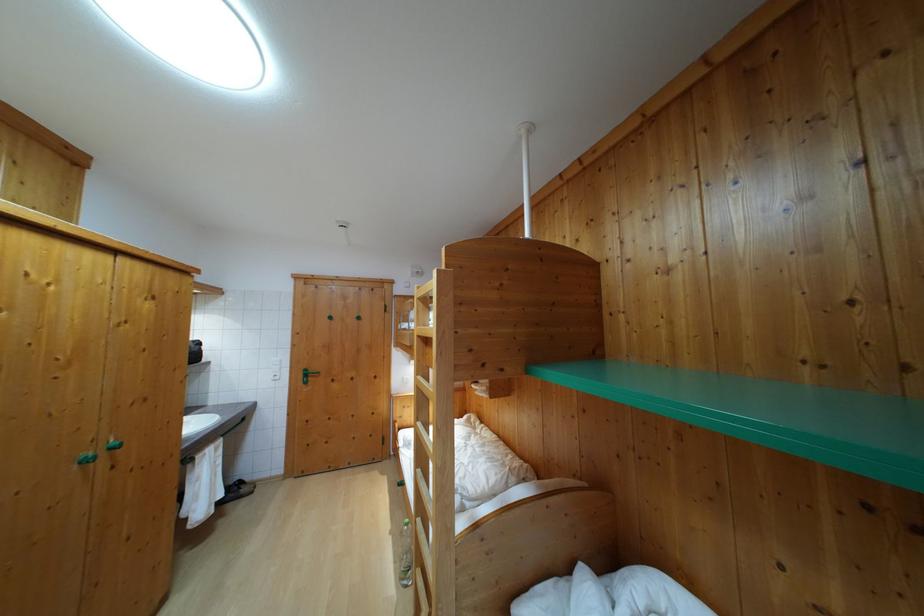
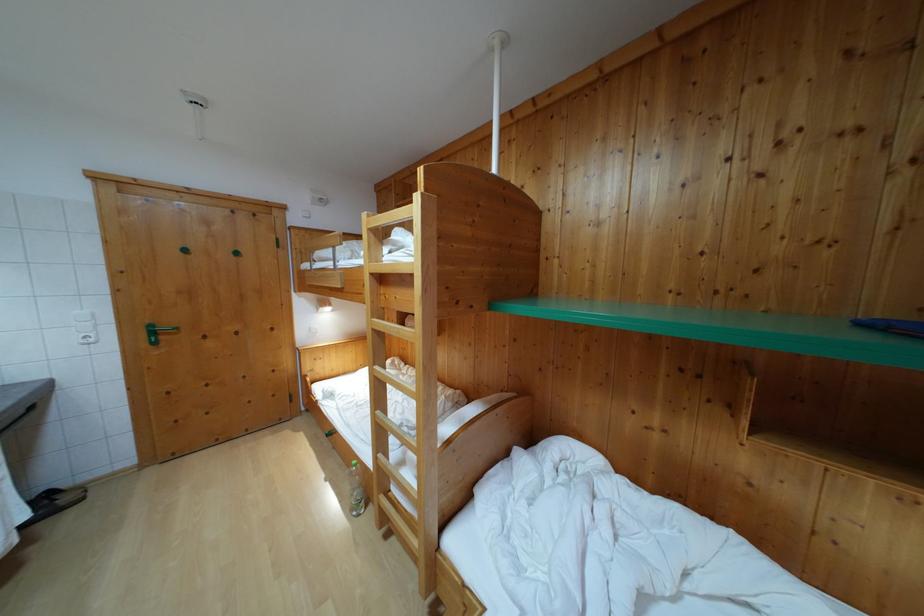
The point at (334, 325) is marked in the first image. Where is the corresponding point in the second image?

(189, 257)